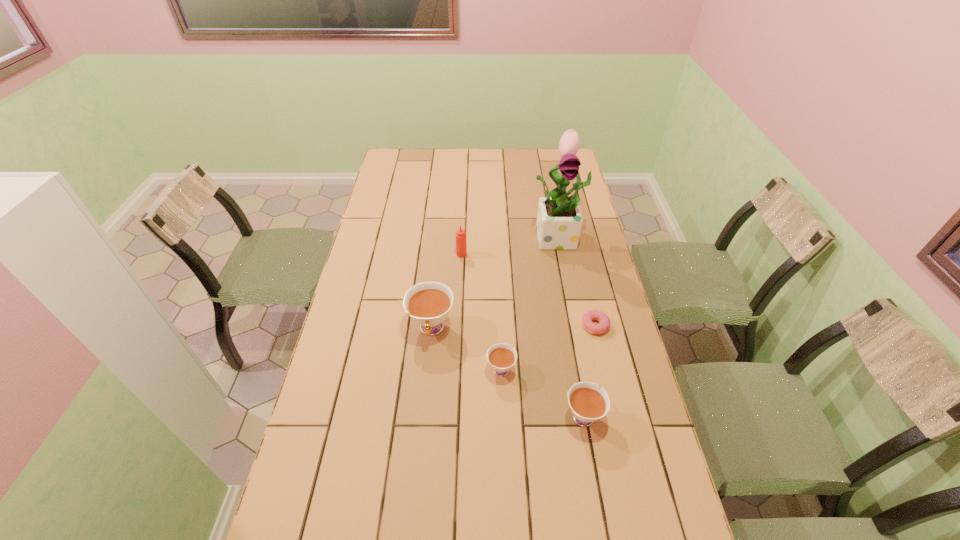
Image resolution: width=960 pixels, height=540 pixels. In order to click on the leftmost teacup in this screenshot , I will do `click(428, 303)`.

The height and width of the screenshot is (540, 960). What are the coordinates of `the tallest teacup` in the screenshot? It's located at (428, 303).

Where is `the second teacup from right to left`? The width and height of the screenshot is (960, 540). the second teacup from right to left is located at coordinates (501, 357).

At what (x,y) coordinates should I click in order to perform the action: click on the third object from left to right. Please return your answer as a coordinate pair (x, y). Looking at the image, I should click on (501, 357).

Where is `the nearest teacup`? Image resolution: width=960 pixels, height=540 pixels. the nearest teacup is located at coordinates (588, 404).

Identify the location of the nearest object. (588, 404).

Find the location of a particular element. The height and width of the screenshot is (540, 960). Tabasco sauce is located at coordinates (461, 244).

The width and height of the screenshot is (960, 540). I want to click on flower arrangement, so click(559, 220).

Image resolution: width=960 pixels, height=540 pixels. What are the coordinates of `doughnut` in the screenshot? It's located at (604, 322).

Locate an element on the screen. This screenshot has height=540, width=960. vacant area situated on the side of the leftmost teacup with the handle is located at coordinates (425, 395).